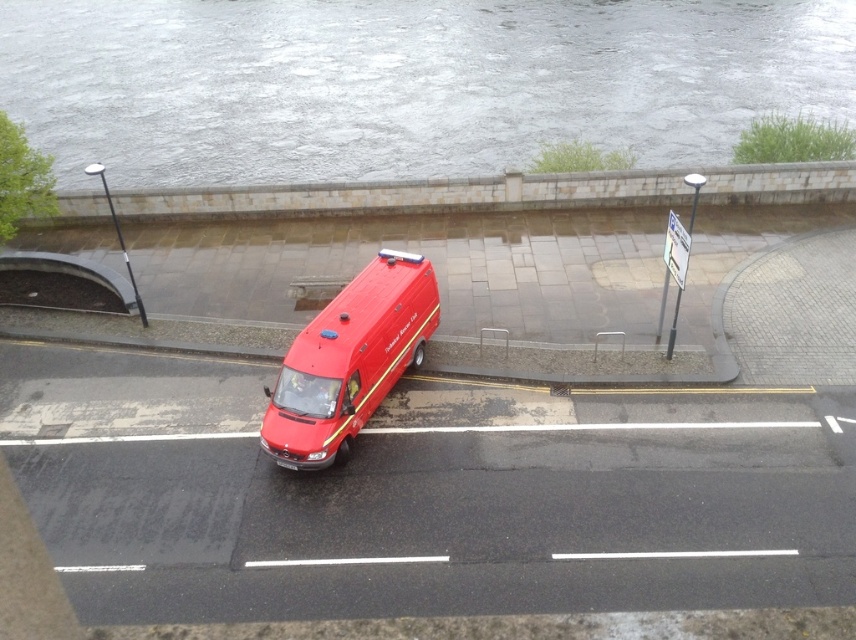
You are driving a car and see the red van parked on the road. There are two points marked on the road. The first point is at coordinates point (235,116) and the second point is at point (270,451). If you are facing the direction of the van, which point is closer to the van?

Point (235,116) is behind point (270,451), so the point closer to the van is point (270,451).

You are a delivery driver who needs to park your truck next to the gray stone wall at upper center and the shiny red van at center. Based on the scene, which object is wider so you can choose a parking spot accordingly?

The gray stone wall at upper center is wider than the shiny red van at center, so you should park next to the gray stone wall at upper center to accommodate your truck.

You are a delivery driver who needs to back up your shiny red van at center to make a turn. The gray stone wall at upper center is in your way. Can you safely back up without hitting the wall if your van requires 100 feet of space to turn?

The distance between the gray stone wall at upper center and the shiny red van at center is 89.71 feet. Since the van needs 100 feet of space to turn, there isn not enough space to safely back up without hitting the wall.